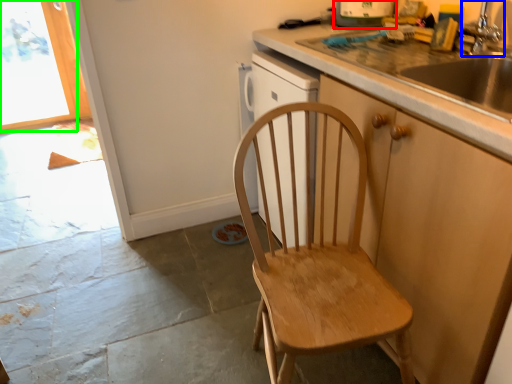
Question: Based on their relative distances, which object is farther from kitchen appliance (highlighted by a red box)? Choose from faucet (highlighted by a blue box) and window (highlighted by a green box).

Choices:
 (A) faucet
 (B) window

Answer: (B)